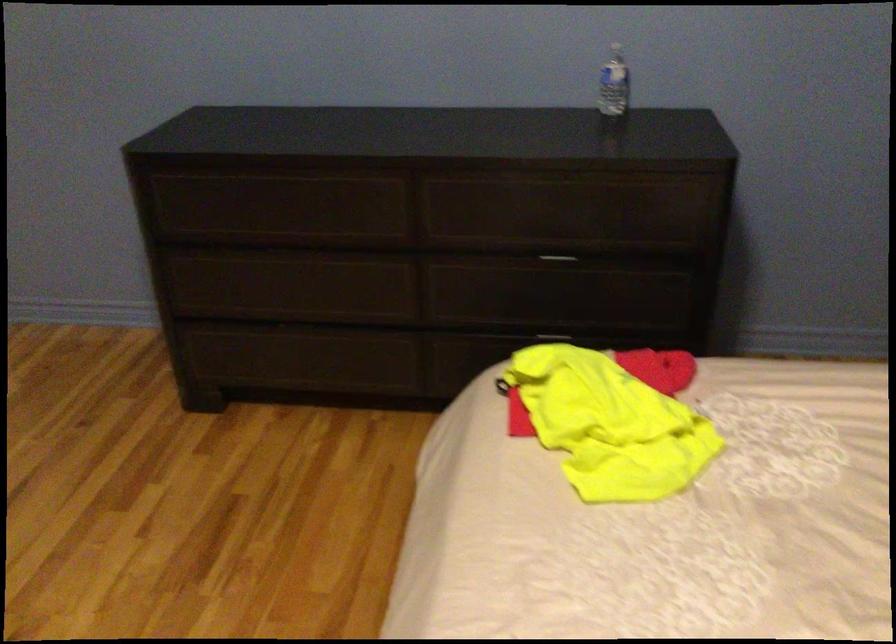
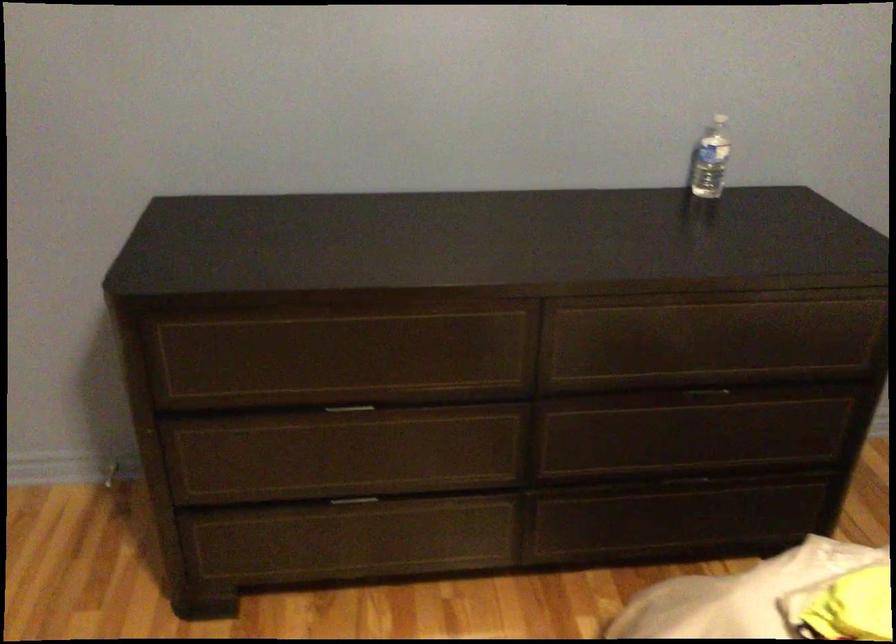
In a continuous first-person perspective shot, in which direction is the camera moving?

The movement direction of the cameraman is left, forward.